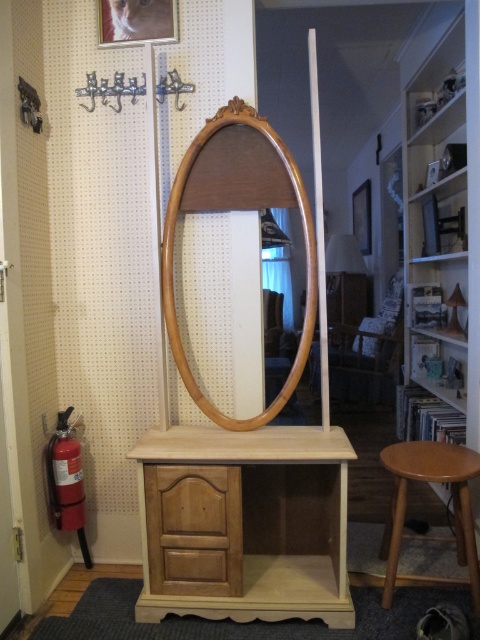
This screenshot has width=480, height=640. What do you see at coordinates (237, 209) in the screenshot?
I see `wooden mirror at center` at bounding box center [237, 209].

Between point (228, 164) and point (148, 484), which one is positioned behind?

The point (228, 164) is more distant.

Is point (302, 204) behind point (192, 550)?

Yes.

The image size is (480, 640). What are the coordinates of `wooden mirror at center` in the screenshot? It's located at (237, 209).

How distant is wooden mirror at center from light brown wooden stool at lower right?

28.08 inches

How distant is wooden mirror at center from light brown wooden stool at lower right?

The distance of wooden mirror at center from light brown wooden stool at lower right is 71.32 centimeters.

Is point (282, 394) positioned after point (431, 477)?

Yes, point (282, 394) is behind point (431, 477).

Where is `wooden mirror at center`? The image size is (480, 640). wooden mirror at center is located at coordinates (237, 209).

Who is higher up, light wood vanity at center or light brown wood drawer at center?

light brown wood drawer at center is higher up.

Which is behind, point (320, 589) or point (167, 518)?

Point (320, 589)

The image size is (480, 640). What are the coordinates of `light wood vanity at center` in the screenshot? It's located at (248, 524).